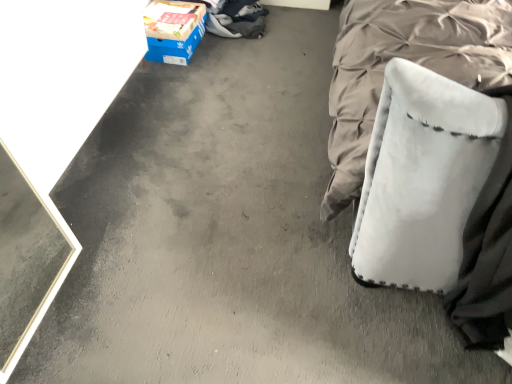
What are the coordinates of `free location above blue cardboard box at upper left (from a real-world perspective)` in the screenshot? It's located at (165, 29).